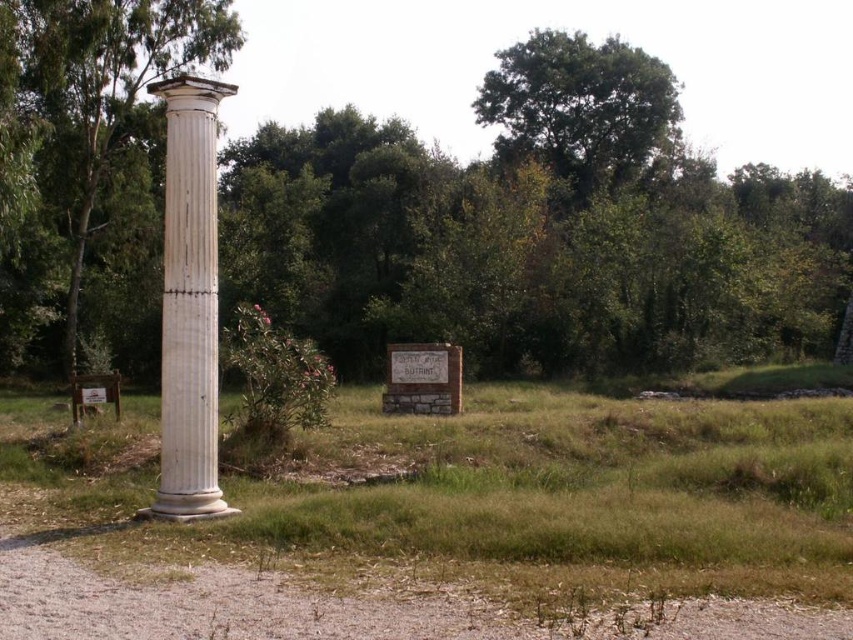
Who is positioned more to the left, white marble column at left or white smooth column at left?

white smooth column at left

Does white marble column at left appear on the left side of white smooth column at left?

No, white marble column at left is not to the left of white smooth column at left.

Who is more forward, (6, 620) or (10, 237)?

Point (6, 620) is more forward.

The image size is (853, 640). I want to click on white marble column at left, so click(450, 520).

Is white marble column at left below green leafy tree at upper center?

Correct, white marble column at left is located below green leafy tree at upper center.

Can you confirm if white marble column at left is wider than green leafy tree at upper center?

No, white marble column at left is not wider than green leafy tree at upper center.

Who is more forward, (706, 486) or (635, 125)?

Point (706, 486)

Image resolution: width=853 pixels, height=640 pixels. I want to click on white marble column at left, so click(x=450, y=520).

Can you confirm if white marble column at center is thinner than green leafy tree at upper center?

Yes, white marble column at center is thinner than green leafy tree at upper center.

Can you confirm if white marble column at center is positioned below green leafy tree at upper center?

Yes, white marble column at center is below green leafy tree at upper center.

What do you see at coordinates (189, 304) in the screenshot? I see `white marble column at center` at bounding box center [189, 304].

Locate an element on the screen. The height and width of the screenshot is (640, 853). white marble column at center is located at coordinates (189, 304).